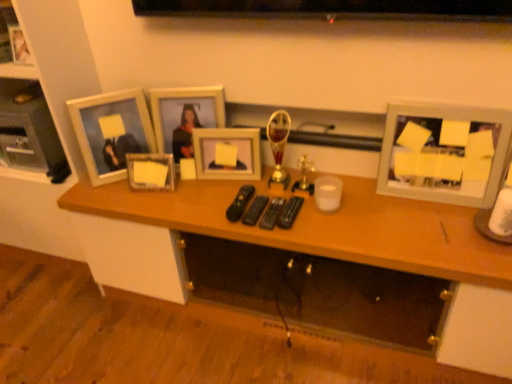
Locate an element on the screen. The image size is (512, 384). vacant space in between matte glass picture frame at center, which appears as the fifth picture frame when viewed from the left, and black plastic remote at center, positioned as the 1th remote control in left-to-right order is located at coordinates (222, 189).